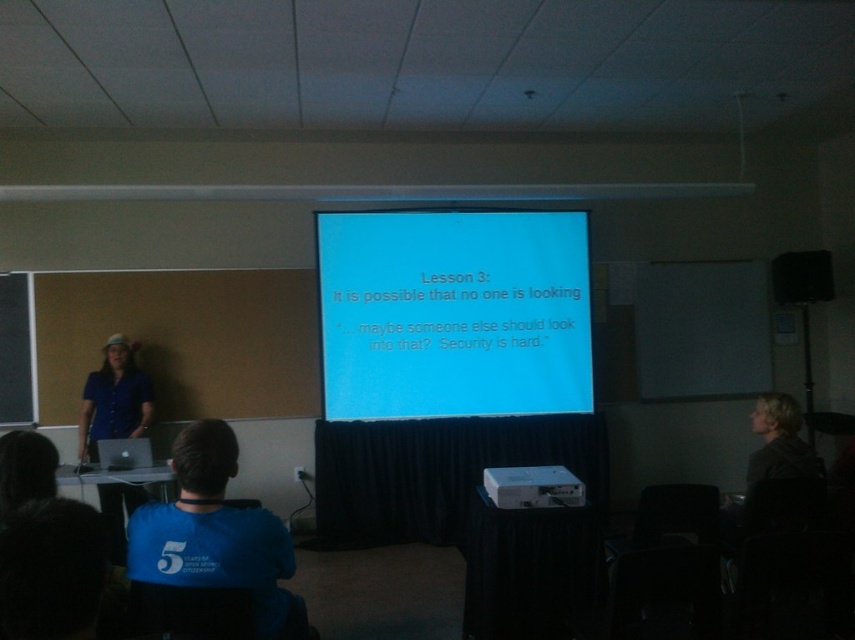
Question: Does blue matte projector screen at center appear over white plastic projector at center?

Choices:
 (A) no
 (B) yes

Answer: (B)

Question: Estimate the real-world distances between objects in this image. Which object is closer to the matte black speaker at upper right?

Choices:
 (A) blue matte projector screen at center
 (B) blue fabric shirt at left
 (C) white plastic projector at center

Answer: (A)

Question: Which object appears farthest from the camera in this image?

Choices:
 (A) blue matte projector screen at center
 (B) blue fabric shirt at left
 (C) white plastic projector at center
 (D) matte black speaker at upper right

Answer: (D)

Question: Which of the following is the farthest from the observer?

Choices:
 (A) [127, 396]
 (B) [193, 426]

Answer: (A)

Question: Observing the image, what is the correct spatial positioning of blue fabric shirt at left in reference to white plastic projector at center?

Choices:
 (A) below
 (B) above

Answer: (B)

Question: Does blue matte projector screen at center have a lesser width compared to blue fabric shirt at left?

Choices:
 (A) yes
 (B) no

Answer: (B)